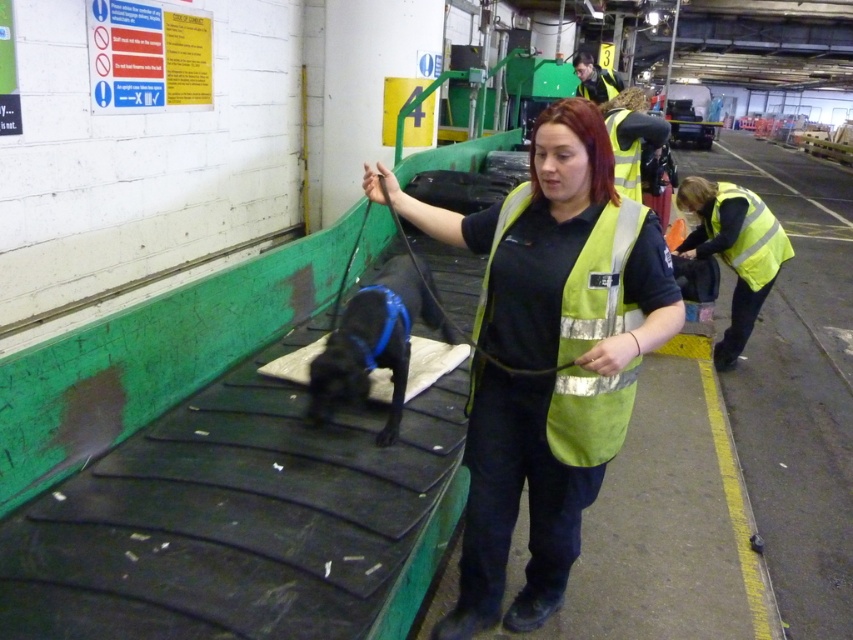
You are a new worker in the recycling facility and need to locate the supervisor. The supervisor is wearing a reflective yellow vest and is closer to the conveyor belt. Which reflective yellow vest should you approach? The reflective yellow vest at center or the reflective yellow vest at upper center?

The reflective yellow vest at center is in front of the reflective yellow vest at upper center, so the reflective yellow vest at center is closer to the conveyor belt and should be approached.

You are an inspector in this recycling facility. You notice two reflective yellow vests in the scene. Which one is closer to you, the reflective yellow vest at center or the reflective yellow vest at upper center?

The reflective yellow vest at center is closer to you because it appears larger in size than the reflective yellow vest at upper center.